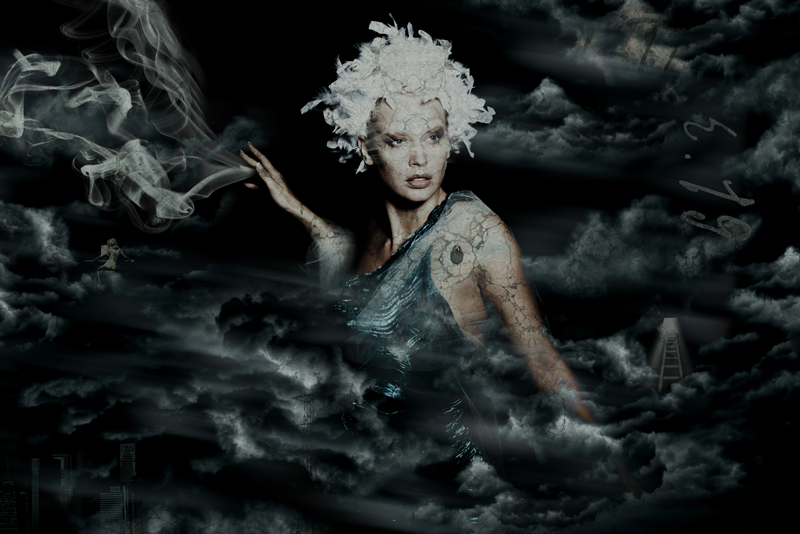
At what (x,y) coordinates should I click in order to perform the action: click on ladder. Please return your answer as a coordinate pair (x, y). The image size is (800, 534). Looking at the image, I should click on (676, 357).